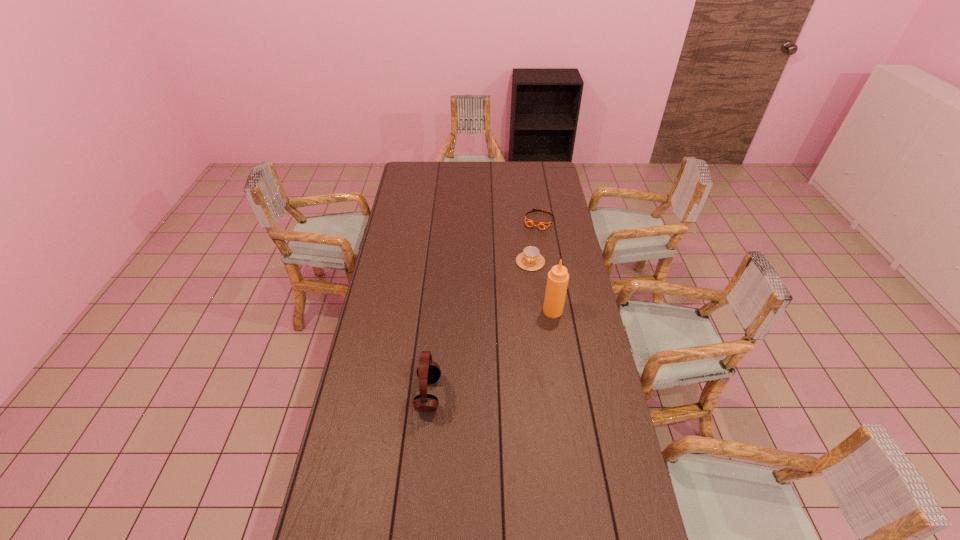
Find the location of a particular element. The image size is (960, 540). vacant space located 0.050m with the lenses facing forward on the goggles is located at coordinates (533, 237).

Where is `vacant space located with the lenses facing forward on the goggles`? vacant space located with the lenses facing forward on the goggles is located at coordinates (516, 275).

Where is `vacant position located with the lenses facing forward on the goggles`? The height and width of the screenshot is (540, 960). vacant position located with the lenses facing forward on the goggles is located at coordinates (519, 267).

The height and width of the screenshot is (540, 960). What are the coordinates of `free space located with the handle on the side of the third nearest object` in the screenshot? It's located at (522, 283).

At what (x,y) coordinates should I click in order to perform the action: click on free space located 0.350m with the handle on the side of the third nearest object. Please return your answer as a coordinate pair (x, y). This screenshot has height=540, width=960. Looking at the image, I should click on (505, 328).

This screenshot has width=960, height=540. I want to click on free region located 0.160m with the handle on the side of the third nearest object, so click(517, 295).

Where is `condiment present at the right edge`? The image size is (960, 540). condiment present at the right edge is located at coordinates click(x=557, y=282).

Where is `goggles that is at the right edge`? The image size is (960, 540). goggles that is at the right edge is located at coordinates (542, 225).

I want to click on cup that is at the right edge, so click(530, 259).

Find the location of a particular element. vacant space at the far edge of the desktop is located at coordinates (449, 174).